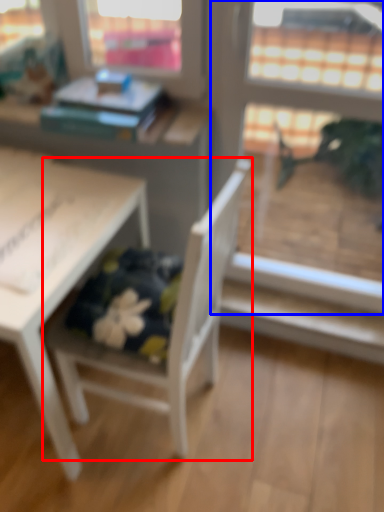
Question: Which of the following is the farthest to the observer, chair (highlighted by a red box) or screen door (highlighted by a blue box)?

Choices:
 (A) chair
 (B) screen door

Answer: (B)